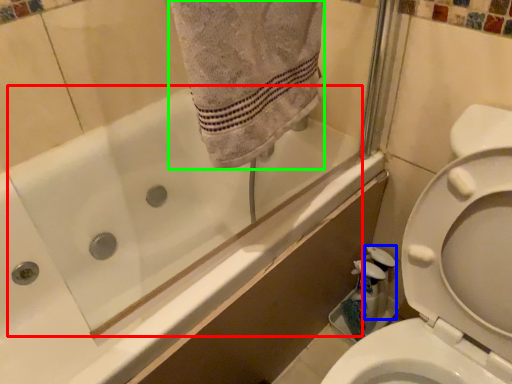
Question: Based on their relative distances, which object is nearer to bath (highlighted by a red box)? Choose from cleaning product (highlighted by a blue box) and bath towel (highlighted by a green box).

Choices:
 (A) cleaning product
 (B) bath towel

Answer: (B)